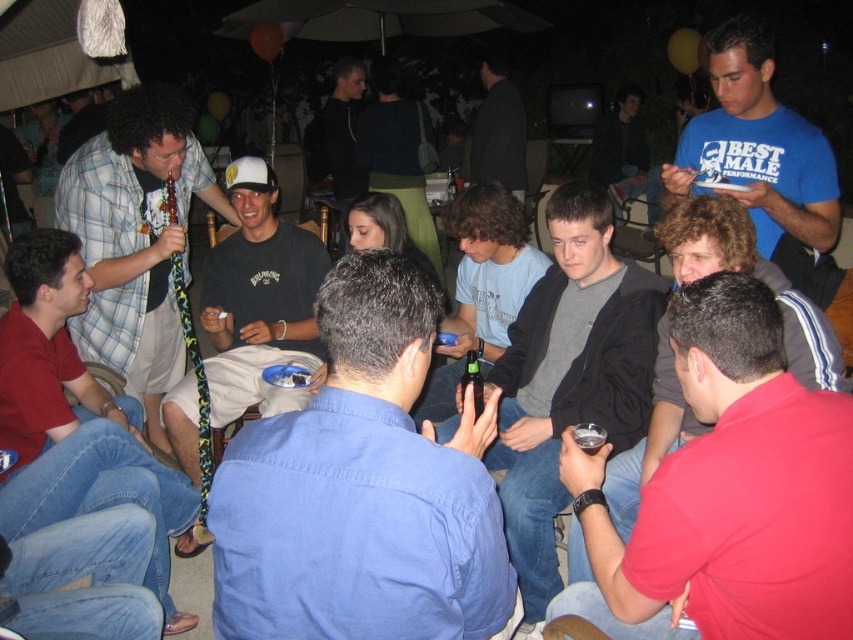
You are at a party and want to hand out a drink to both the gray cotton shirt at center and the plaid shirt at center. Which one should you give the drink to first if you want to reach the taller person first?

You should give the drink to the gray cotton shirt at center first because the gray cotton shirt at center is taller than the plaid shirt at center.

You are at a party and want to introduce yourself to the two people wearing the gray cotton shirt at center and the plaid shirt at center. Which one should you approach first if you want to start with the person on the left?

You should approach the plaid shirt at center first because the gray cotton shirt at center is positioned on the right side of plaid shirt at center.